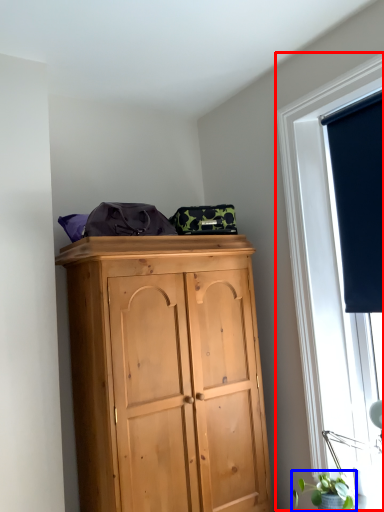
Question: Which object appears closest to the camera in this image, window (highlighted by a red box) or plant (highlighted by a blue box)?

Choices:
 (A) window
 (B) plant

Answer: (B)